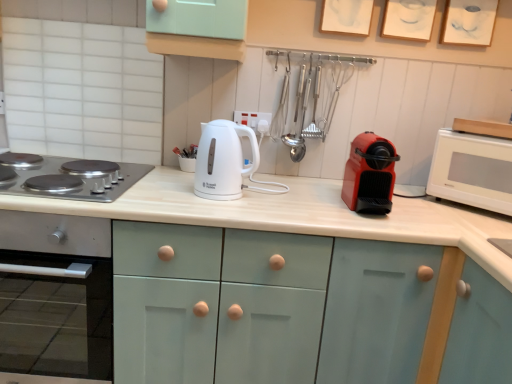
Find the location of `free space that is to the left of white glossy electric kettle at center, which appears as the 2th kitchen appliance when viewed from the right`. free space that is to the left of white glossy electric kettle at center, which appears as the 2th kitchen appliance when viewed from the right is located at coordinates (164, 191).